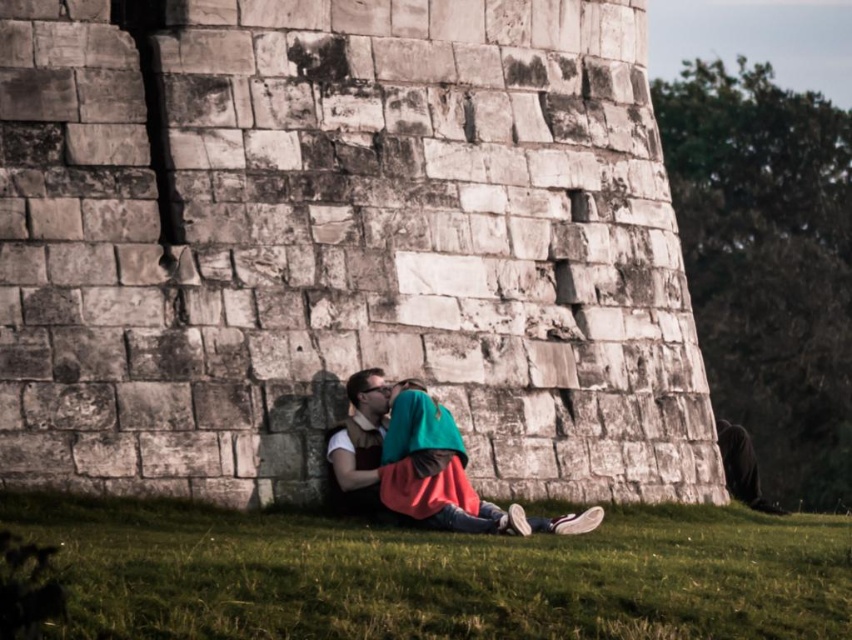
Question: Can you confirm if green grass at lower center is smaller than teal fabric scarf at center?

Choices:
 (A) no
 (B) yes

Answer: (A)

Question: Is green grass at lower center positioned at the back of matte brown vest at center?

Choices:
 (A) no
 (B) yes

Answer: (A)

Question: Which of these objects is positioned closest to the teal fabric scarf at center?

Choices:
 (A) matte brown vest at center
 (B) green grass at lower center

Answer: (A)

Question: Which object appears closest to the camera in this image?

Choices:
 (A) teal fabric scarf at center
 (B) matte brown vest at center
 (C) green grass at lower center

Answer: (C)

Question: Is green grass at lower center below matte brown vest at center?

Choices:
 (A) yes
 (B) no

Answer: (A)

Question: Which object appears farthest from the camera in this image?

Choices:
 (A) green grass at lower center
 (B) matte brown vest at center

Answer: (B)